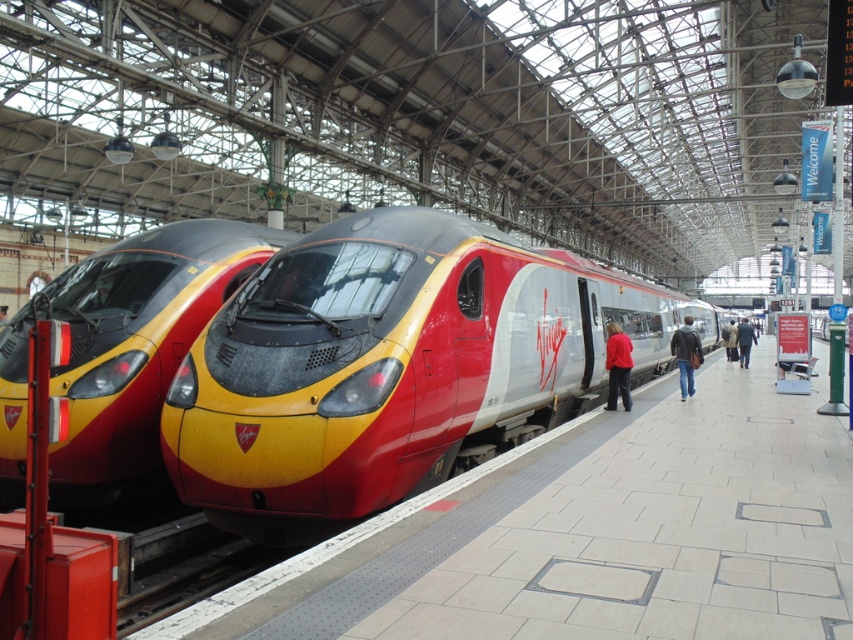
Question: Observing the image, what is the correct spatial positioning of red fabric jacket at center in reference to dark blue coat at platform center?

Choices:
 (A) above
 (B) below

Answer: (A)

Question: Can you confirm if metallic red train at center is wider than metallic red/yellow train at center?

Choices:
 (A) no
 (B) yes

Answer: (B)

Question: Which of the following is the farthest from the observer?

Choices:
 (A) (680, 394)
 (B) (740, 355)

Answer: (B)

Question: Which object is positioned closest to the dark blue coat at platform center?

Choices:
 (A) leather jacket at platform
 (B) metallic red train at center
 (C) metallic red/yellow train at center
 (D) red fabric jacket at center

Answer: (A)

Question: Can you confirm if leather jacket at platform is smaller than dark brown leather coat at platform center?

Choices:
 (A) yes
 (B) no

Answer: (A)

Question: Which object is positioned closest to the metallic red train at center?

Choices:
 (A) red fabric jacket at center
 (B) metallic red/yellow train at center

Answer: (A)